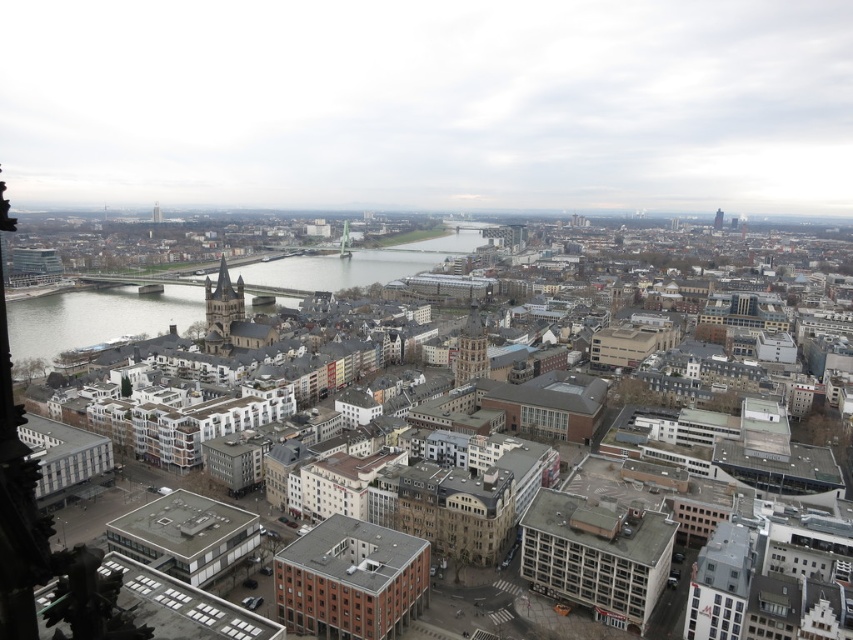
Is clear glass water at center smaller than red brick tower at upper right?

No.

Can you confirm if clear glass water at center is positioned below red brick tower at upper right?

Indeed, clear glass water at center is positioned under red brick tower at upper right.

Which is in front, point (344, 273) or point (722, 220)?

Point (344, 273) is more forward.

Locate an element on the screen. This screenshot has height=640, width=853. clear glass water at center is located at coordinates (97, 316).

Between point (334, 266) and point (155, 202), which one is positioned behind?

Positioned behind is point (155, 202).

How far apart are clear glass water at center and smooth gray tower at upper left?

clear glass water at center and smooth gray tower at upper left are 685.78 feet apart.

Locate an element on the screen. The width and height of the screenshot is (853, 640). clear glass water at center is located at coordinates (97, 316).

Between clear glass water at center and brown stone tower at center-left, which one is positioned higher?

clear glass water at center is higher up.

How much distance is there between clear glass water at center and brown stone tower at center-left?

110.54 meters

Is point (7, 310) farther from viewer compared to point (224, 280)?

Yes, point (7, 310) is behind point (224, 280).

This screenshot has width=853, height=640. In order to click on clear glass water at center in this screenshot , I will do `click(97, 316)`.